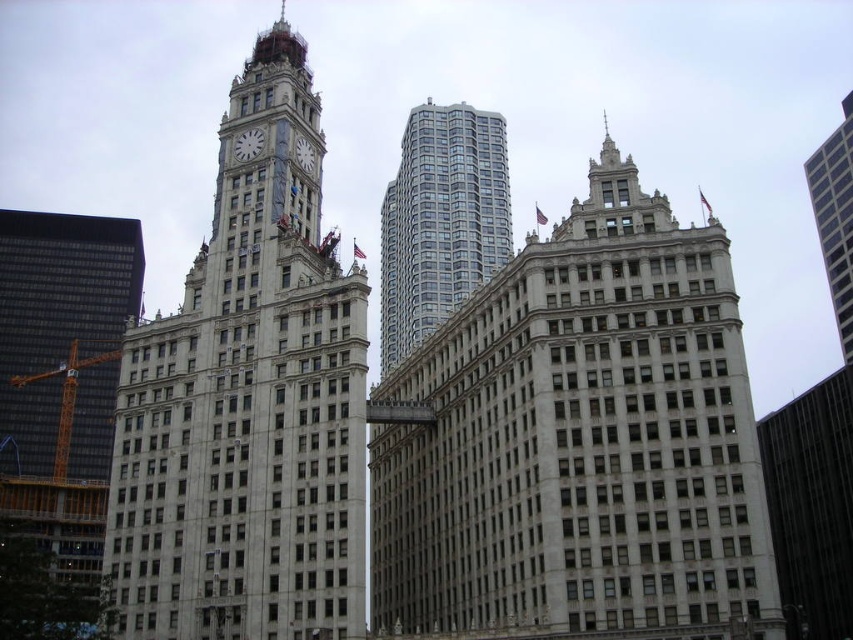
Question: Which point is closer to the camera?

Choices:
 (A) (821, 212)
 (B) (416, 436)
 (C) (4, 593)

Answer: (C)

Question: Does white marble clock at center have a lesser width compared to white marble clock at upper center?

Choices:
 (A) yes
 (B) no

Answer: (B)

Question: Which object is farther from the camera taking this photo?

Choices:
 (A) white stone clock tower at center
 (B) white marble clock at upper center
 (C) white marble clock at center

Answer: (B)

Question: Considering the real-world distances, which object is farthest from the white stone building at center?

Choices:
 (A) glassy silver skyscraper at center
 (B) white stone clock tower at center
 (C) white marble clock at upper center
 (D) white marble clock at center

Answer: (A)

Question: Is white stone building at center positioned before dark glass skyscraper at left?

Choices:
 (A) no
 (B) yes

Answer: (A)

Question: Can you confirm if gray glass skyscraper at upper right is positioned below white marble clock at center?

Choices:
 (A) yes
 (B) no

Answer: (B)